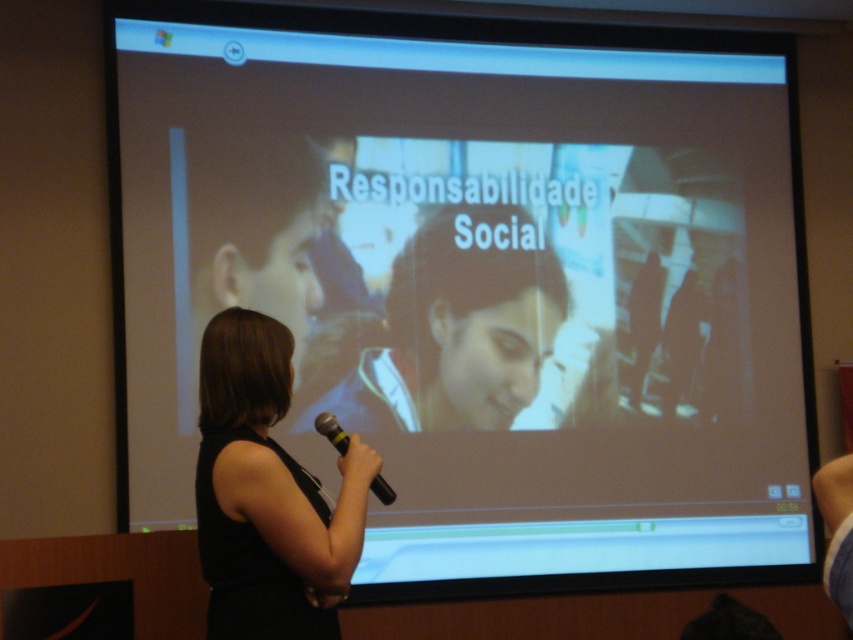
You are an event organizer who needs to ensure the microphone is visible to the audience. Based on the scene, is the yellow rubber microphone at center obscured by the black fabric at center?

The black fabric at center is taller than the yellow rubber microphone at center, so it may be blocking the microphone from the audience.

You are an attendee at the presentation and want to hand the presenter a note. You have a yellow rubber microphone at center in your hand. The black fabric at center is part of her outfit. Which object should you avoid touching to prevent disrupting her?

You should avoid touching the black fabric at center, as it is closer to the viewer and part of her outfit, while the yellow rubber microphone at center is in her hand. Disturbing the microphone might interrupt her presentation.

You are an attendee at the presentation. You notice a point marked at coordinates (267,493) on the screen. What is located at that point?

The point at coordinates (267,493) marks the black fabric at center.